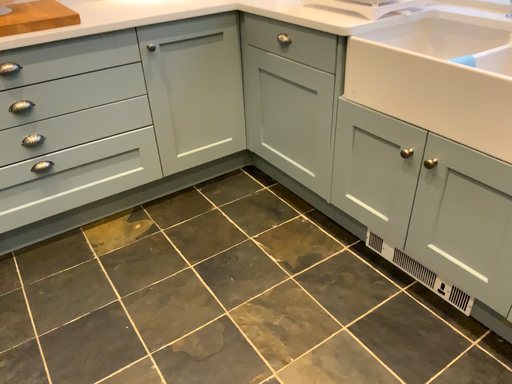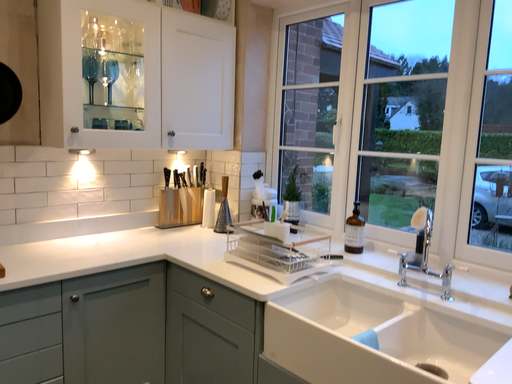
Question: How did the camera likely rotate when shooting the video?

Choices:
 (A) rotated right
 (B) rotated left

Answer: (A)